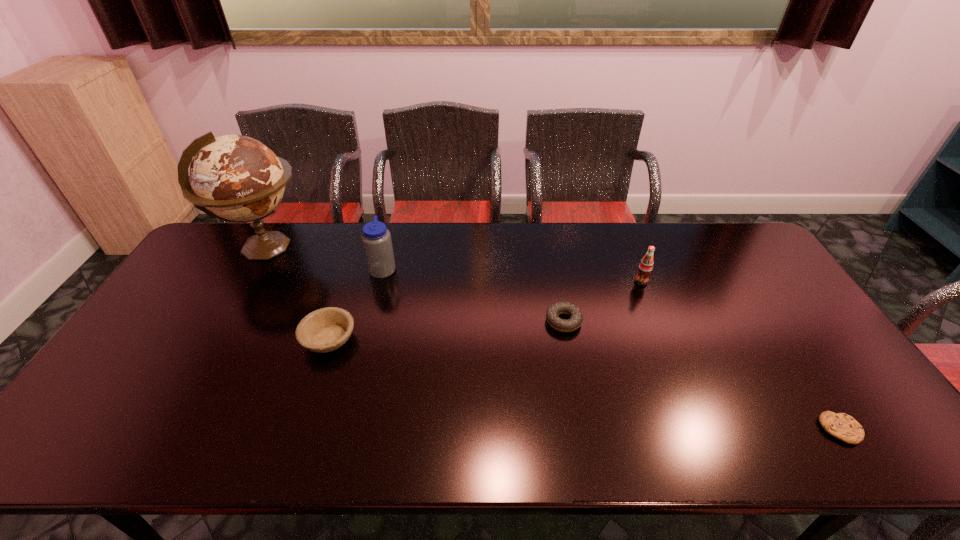
Find the location of a particular element. The width and height of the screenshot is (960, 540). vacant region that satisfies the following two spatial constraints: 1. on the back side of the third shortest object; 2. on the front of the leftmost object showing Asia is located at coordinates (359, 248).

At what (x,y) coordinates should I click in order to perform the action: click on blank space that satisfies the following two spatial constraints: 1. on the back side of the fourth shortest object; 2. on the front of the tallest object showing Asia. Please return your answer as a coordinate pair (x, y). Looking at the image, I should click on (628, 248).

You are a GUI agent. You are given a task and a screenshot of the screen. Output one action in this format:
    pyautogui.click(x=<x>, y=<y>)
    Task: Click on the free space in the image that satisfies the following two spatial constraints: 1. on the back side of the nearest object; 2. with a carrying loop on the side of the water bottle
    
    Given the screenshot: What is the action you would take?
    pyautogui.click(x=734, y=268)

Locate an element on the screen. vacant position in the image that satisfies the following two spatial constraints: 1. on the front side of the cookie; 2. on the left side of the soda is located at coordinates (700, 429).

Locate an element on the screen. free point that satisfies the following two spatial constraints: 1. with a carrying loop on the side of the second shortest object; 2. on the right side of the fifth shortest object is located at coordinates (370, 321).

This screenshot has width=960, height=540. I want to click on free space in the image that satisfies the following two spatial constraints: 1. with a carrying loop on the side of the water bottle; 2. on the right side of the shortest object, so click(343, 429).

The image size is (960, 540). I want to click on vacant space that satisfies the following two spatial constraints: 1. on the front of the shortest object showing Asia; 2. on the left side of the globe, so click(x=161, y=429).

Where is `free space that satisfies the following two spatial constraints: 1. on the front of the tallest object showing Asia; 2. on the left side of the second object from right to left`? This screenshot has width=960, height=540. free space that satisfies the following two spatial constraints: 1. on the front of the tallest object showing Asia; 2. on the left side of the second object from right to left is located at coordinates (247, 281).

Find the location of a particular element. The height and width of the screenshot is (540, 960). vacant region that satisfies the following two spatial constraints: 1. on the front of the globe showing Asia; 2. on the right side of the soda is located at coordinates (247, 281).